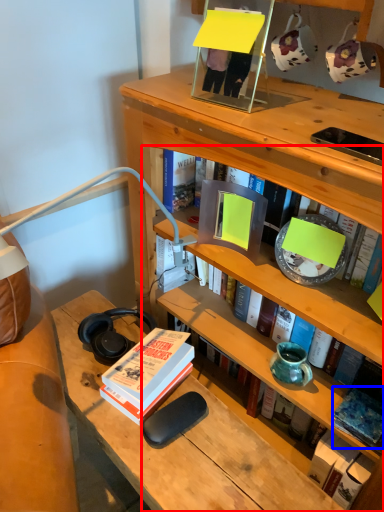
Question: Which object is closer to the camera taking this photo, book (highlighted by a red box) or book (highlighted by a blue box)?

Choices:
 (A) book
 (B) book

Answer: (A)